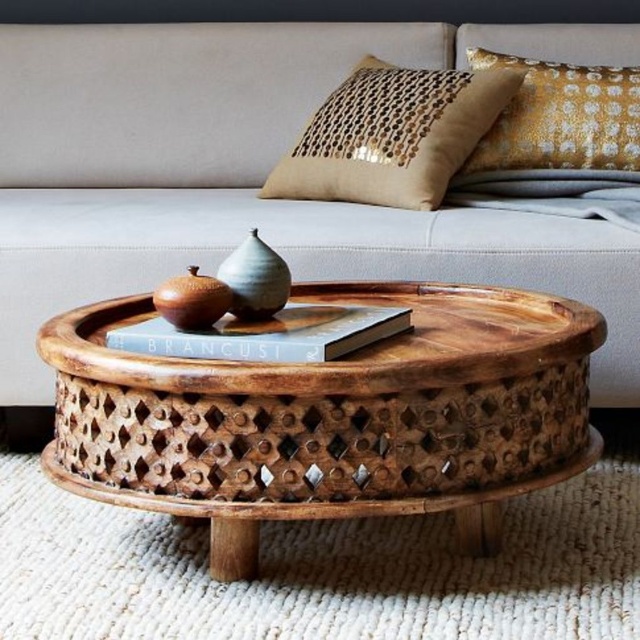
Question: Which of the following is the closest to the observer?

Choices:
 (A) natural wood carved coffee table at center
 (B) neutral fabric couch at center

Answer: (A)

Question: Is neutral fabric couch at center wider than gold textured pillow at upper right?

Choices:
 (A) yes
 (B) no

Answer: (A)

Question: Is natural wood carved coffee table at center positioned behind gold sequined pillow at upper right?

Choices:
 (A) no
 (B) yes

Answer: (A)

Question: Can you confirm if neutral fabric couch at center is thinner than gold sequined pillow at upper right?

Choices:
 (A) no
 (B) yes

Answer: (A)

Question: Among these points, which one is nearest to the camera?

Choices:
 (A) (300, 349)
 (B) (84, 134)

Answer: (A)

Question: Which point is closer to the camera?

Choices:
 (A) (116, 346)
 (B) (595, 99)
 (C) (502, 33)
 (D) (461, 97)

Answer: (A)